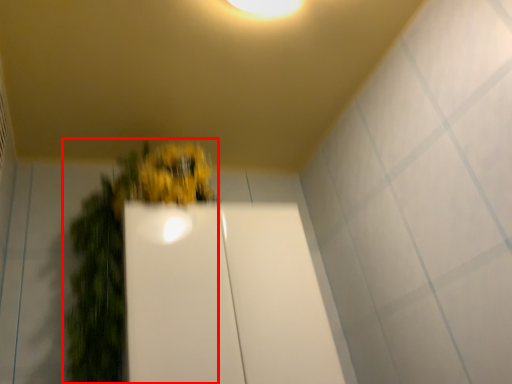
Question: From the image's perspective, what is the correct spatial positioning of houseplant (annotated by the red box) in reference to glass door?

Choices:
 (A) below
 (B) above

Answer: (B)